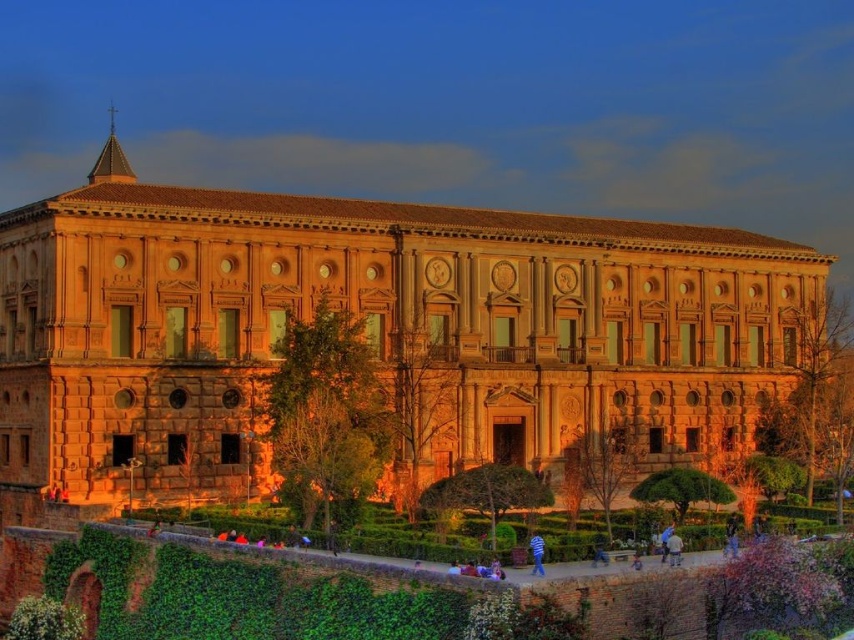
Between brown stone building at center and blue striped shirt at lower center, which one has less height?

Standing shorter between the two is blue striped shirt at lower center.

Is point (72, 272) closer to camera compared to point (533, 547)?

No, it is not.

Where is `brown stone building at center`? This screenshot has width=854, height=640. brown stone building at center is located at coordinates (376, 332).